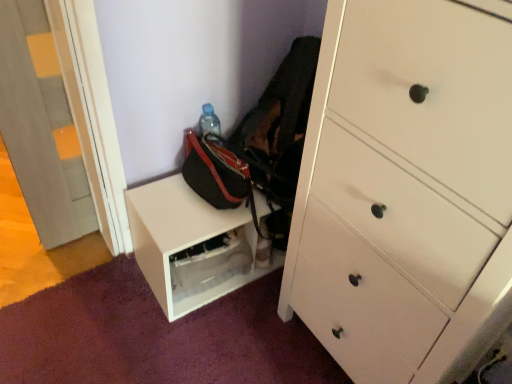
Image resolution: width=512 pixels, height=384 pixels. What are the coordinates of `empty space that is to the right of white matte shelf at lower center` in the screenshot? It's located at (261, 308).